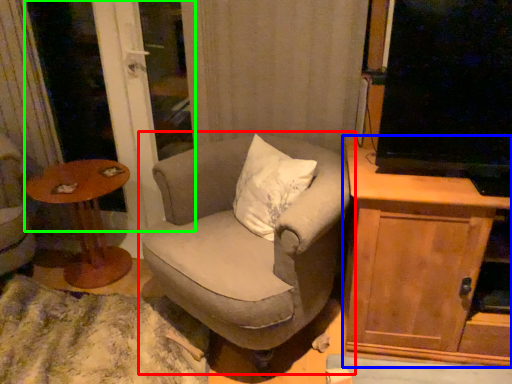
Question: Estimate the real-world distances between objects in this image. Which object is farther from chair (highlighted by a red box), cabinetry (highlighted by a blue box) or screen door (highlighted by a green box)?

Choices:
 (A) cabinetry
 (B) screen door

Answer: (B)